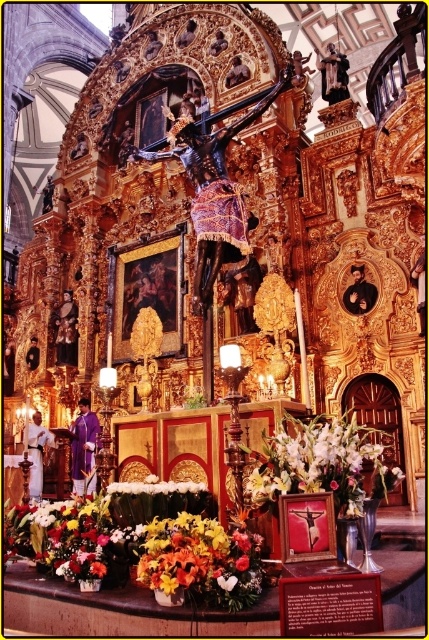
Between point (117, 580) and point (323, 435), which one is positioned in front?

Point (323, 435)

Which is above, floral bouquet at lower center or white silk flowers at center?

white silk flowers at center is above.

You are a GUI agent. You are given a task and a screenshot of the screen. Output one action in this format:
    pyautogui.click(x=<x>, y=<y>)
    Task: Click on the floral bouquet at lower center
    The height and width of the screenshot is (640, 429).
    Given the screenshot: What is the action you would take?
    pyautogui.click(x=141, y=550)

Between white silk flowers at center and white floral bouquet at center, which one appears on the left side from the viewer's perspective?

white floral bouquet at center is more to the left.

Where is `white silk flowers at center`? The width and height of the screenshot is (429, 640). white silk flowers at center is located at coordinates (320, 465).

Locate an element on the screen. white silk flowers at center is located at coordinates (320, 465).

In the scene shown: Between floral bouquet at lower center and white floral bouquet at center, which one appears on the right side from the viewer's perspective?

Positioned to the right is white floral bouquet at center.

How far apart are floral bouquet at lower center and white floral bouquet at center?

floral bouquet at lower center is 13.49 feet from white floral bouquet at center.

Image resolution: width=429 pixels, height=640 pixels. I want to click on floral bouquet at lower center, so click(x=141, y=550).